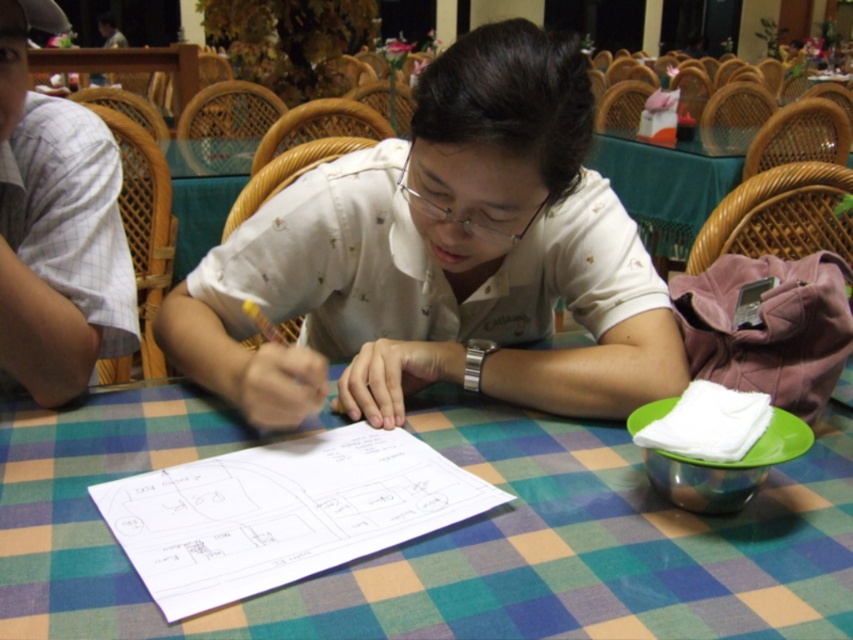
From the picture: You are standing in the dining area and want to place a small vase on the green checkered tablecloth at center. Based on the coordinates provided, where exactly should you place it?

The green checkered tablecloth at center is located at coordinates point (x=439, y=534), so you should place the vase at that position.

You are a photographer trying to capture a closeup of the clear plastic glasses at center. However, the white matte shirt at center is blocking your view. Can you adjust your angle to see the glasses without moving any objects?

The white matte shirt at center is in front of clear plastic glasses at center, so you can adjust your angle slightly to the side or above the shirt to see the glasses without moving anything.

You are an interior designer analyzing the layout of this dining area. The white matte shirt at center is positioned at coordinates 0.406, 0.518. Can you determine if this placement aligns with the central axis of the room?

The white matte shirt at center is located at point [440,259], which indicates it is positioned along the central axis of the room.